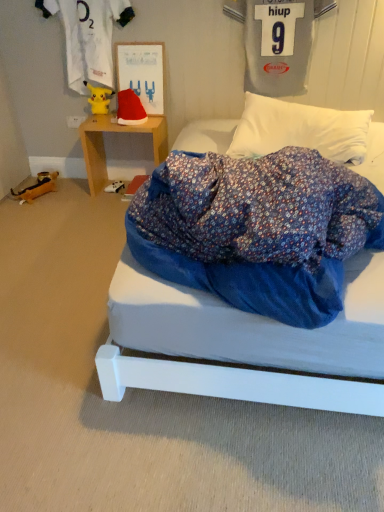
Question: Is matte paperboard at upper center in contact with wooden toy at left, which is the first toy in left-to-right order?

Choices:
 (A) no
 (B) yes

Answer: (A)

Question: Is the position of matte paperboard at upper center more distant than that of wooden toy at left, the second toy positioned from the right?

Choices:
 (A) yes
 (B) no

Answer: (B)

Question: Can you confirm if matte paperboard at upper center is shorter than wooden toy at left, the second toy when ordered from top to bottom?

Choices:
 (A) yes
 (B) no

Answer: (B)

Question: From a real-world perspective, is matte paperboard at upper center below wooden toy at left, the second toy when ordered from top to bottom?

Choices:
 (A) no
 (B) yes

Answer: (A)

Question: Is matte paperboard at upper center not near wooden toy at left, the second toy positioned from the right?

Choices:
 (A) yes
 (B) no

Answer: (B)

Question: Would you say matte paperboard at upper center contains wooden toy at left, the 1th toy from the bottom?

Choices:
 (A) yes
 (B) no

Answer: (B)

Question: Does yellow plush toy at upper left, which is counted as the second clothing, starting from the right, have a greater height compared to wooden toy at left, which is the first toy in left-to-right order?

Choices:
 (A) yes
 (B) no

Answer: (A)

Question: From a real-world perspective, is yellow plush toy at upper left, which is counted as the second clothing, starting from the right, positioned over wooden toy at left, the second toy positioned from the right, based on gravity?

Choices:
 (A) yes
 (B) no

Answer: (A)

Question: Is yellow plush toy at upper left, which is counted as the second clothing, starting from the right, to the left of wooden toy at left, the second toy positioned from the right, from the viewer's perspective?

Choices:
 (A) no
 (B) yes

Answer: (A)

Question: Is wooden toy at left, the second toy positioned from the right, completely or partially inside yellow plush toy at upper left, which is counted as the second clothing, starting from the right?

Choices:
 (A) no
 (B) yes

Answer: (A)

Question: Is yellow plush toy at upper left, which appears as the first clothing when viewed from the left, bigger than wooden toy at left, the second toy positioned from the right?

Choices:
 (A) no
 (B) yes

Answer: (B)

Question: Is fluffy white pillow at upper center located outside gray jersey at upper right, the 1th clothing positioned from the right?

Choices:
 (A) yes
 (B) no

Answer: (A)